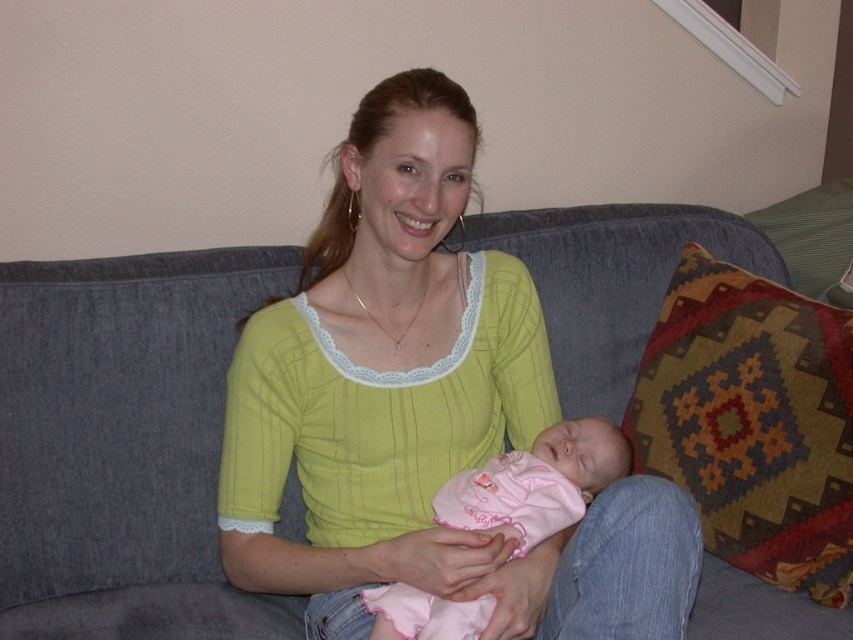
Question: Does multicolored woven pillow at right have a greater width compared to pink fabric baby at center?

Choices:
 (A) no
 (B) yes

Answer: (A)

Question: Is the position of gray fabric couch at center less distant than that of pink fabric baby at center?

Choices:
 (A) no
 (B) yes

Answer: (A)

Question: Which object is farther from the camera taking this photo?

Choices:
 (A) pink fabric baby at center
 (B) multicolored woven pillow at right
 (C) gray fabric couch at center

Answer: (B)

Question: Among these points, which one is nearest to the camera?

Choices:
 (A) (512, 516)
 (B) (740, 504)

Answer: (A)

Question: Is multicolored woven pillow at right to the left of pink fabric baby at center from the viewer's perspective?

Choices:
 (A) no
 (B) yes

Answer: (A)

Question: Which point is farther to the camera?

Choices:
 (A) (479, 604)
 (B) (561, 406)

Answer: (B)